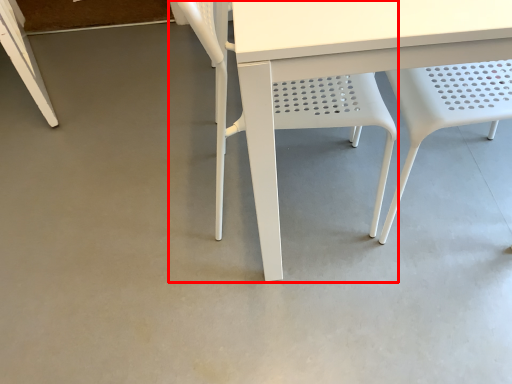
Question: From the image's perspective, where is chair (annotated by the red box) located in relation to chair in the image?

Choices:
 (A) below
 (B) above

Answer: (A)